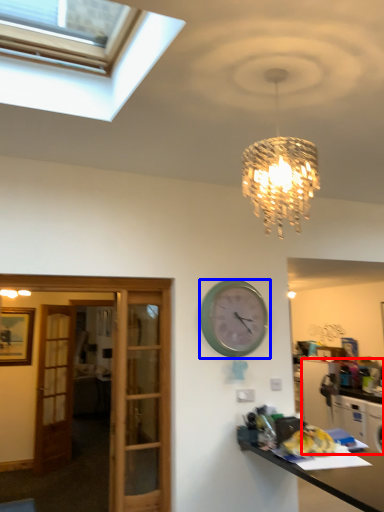
Question: Which object appears closest to the camera in this image, cabinetry (highlighted by a red box) or wall clock (highlighted by a blue box)?

Choices:
 (A) cabinetry
 (B) wall clock

Answer: (B)